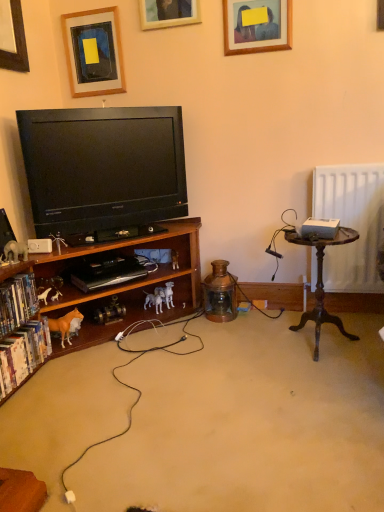
Identify the location of empty space that is in between wooden vintage table at right and woodenmaterial/texture bookcase at left. The image size is (384, 512). (244, 371).